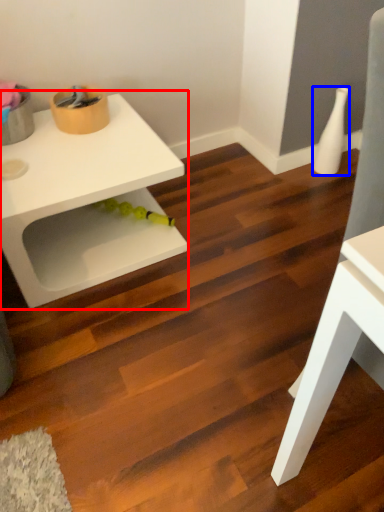
Question: Which point is closer to the camera, table (highlighted by a red box) or vase (highlighted by a blue box)?

Choices:
 (A) table
 (B) vase

Answer: (A)